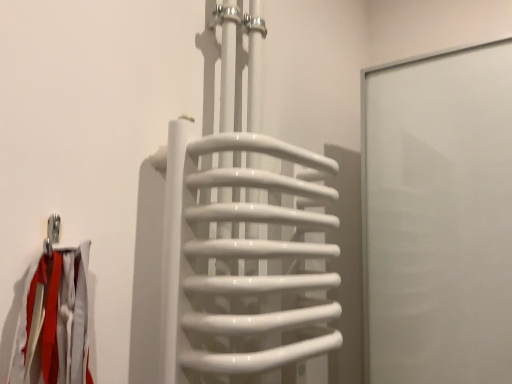
The image size is (512, 384). In order to click on white glossy towel rack at center in this screenshot , I will do `click(250, 242)`.

The image size is (512, 384). What do you see at coordinates (250, 242) in the screenshot? I see `white glossy towel rack at center` at bounding box center [250, 242].

In order to click on white glossy towel rack at center in this screenshot , I will do `click(250, 242)`.